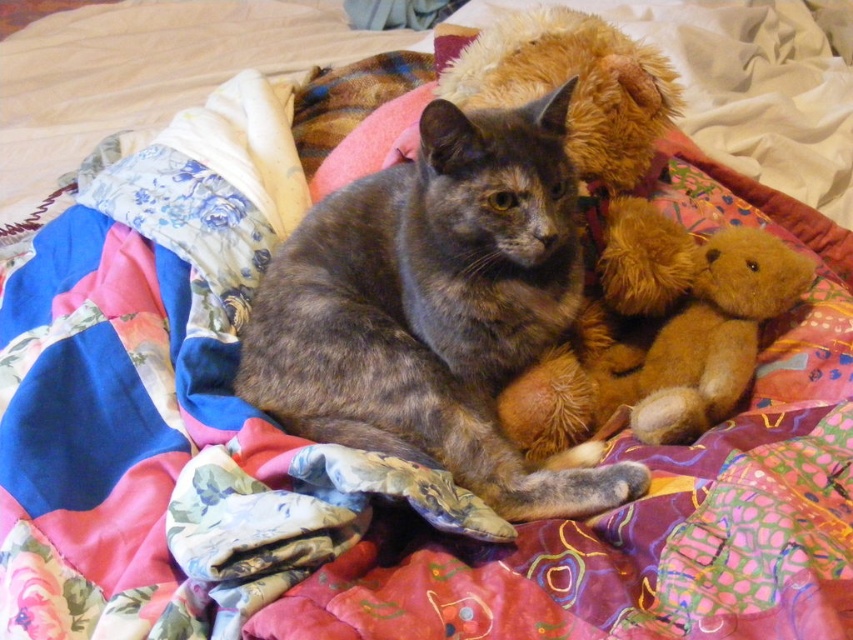
Does gray fur cat at center lie behind fuzzy brown teddy bear at upper right?

No.

Which is behind, point (250, 385) or point (734, 348)?

The point (734, 348) is more distant.

Identify the location of gray fur cat at center. The image size is (853, 640). (434, 307).